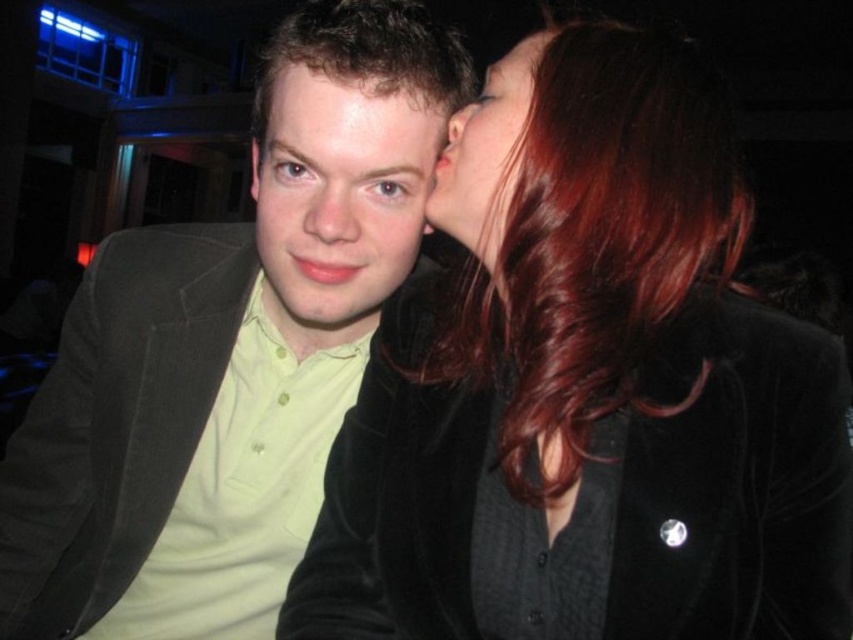
Question: Which point appears farthest from the camera in this image?

Choices:
 (A) click(453, 200)
 (B) click(321, 125)

Answer: (B)

Question: Estimate the real-world distances between objects in this image. Which object is farther from the matte black hair at upper center?

Choices:
 (A) matte green shirt at center
 (B) shiny black hair at upper right
 (C) matte skin at center

Answer: (B)

Question: Which point appears farthest from the camera in this image?

Choices:
 (A) (439, 227)
 (B) (438, 108)
 (C) (28, 616)
 (D) (480, 529)

Answer: (C)

Question: Can you confirm if matte black hair at upper center is positioned below matte skin at center?

Choices:
 (A) yes
 (B) no

Answer: (A)

Question: Can you confirm if matte black jacket at center is positioned to the left of matte green shirt at center?

Choices:
 (A) yes
 (B) no

Answer: (A)

Question: Can you confirm if matte green shirt at center is positioned above matte black hair at upper center?

Choices:
 (A) yes
 (B) no

Answer: (B)